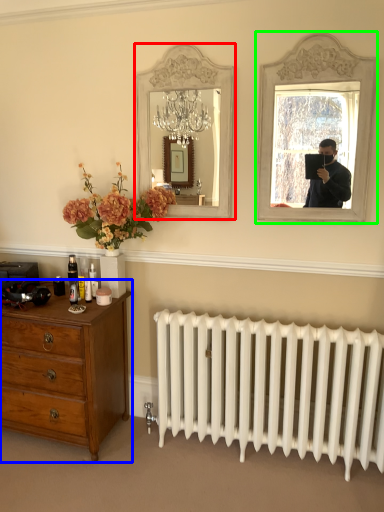
Question: Which object is positioned closest to mirror (highlighted by a red box)? Select from chest of drawers (highlighted by a blue box) and picture frame (highlighted by a green box).

Choices:
 (A) chest of drawers
 (B) picture frame

Answer: (B)